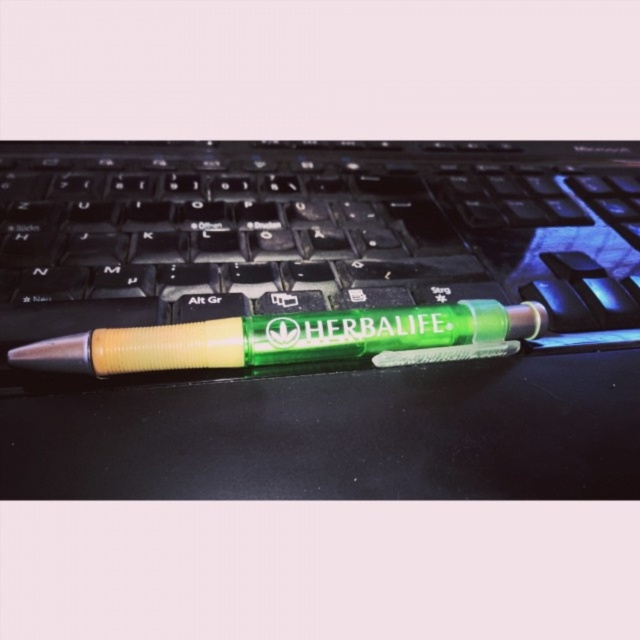
This screenshot has width=640, height=640. I want to click on transparent plastic pen at center, so [x=310, y=230].

Who is more forward, (376, 246) or (538, 328)?

Point (538, 328)

Locate an element on the screen. transparent plastic pen at center is located at coordinates (310, 230).